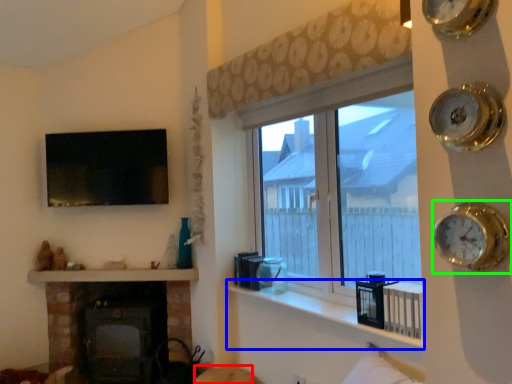
Question: Considering the real-world distances, which object is closest to furniture (highlighted by a red box)? window sill (highlighted by a blue box) or clock (highlighted by a green box).

Choices:
 (A) window sill
 (B) clock

Answer: (A)